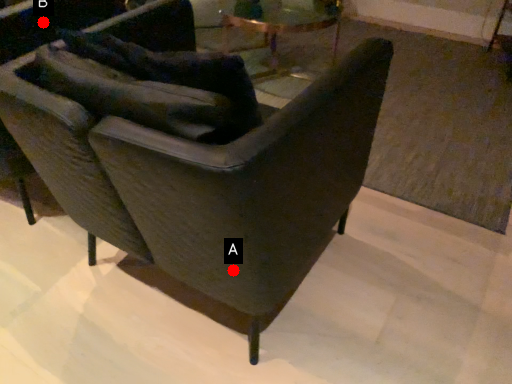
Question: Two points are circled on the image, labeled by A and B beside each circle. Which point is further to the camera?

Choices:
 (A) A is further
 (B) B is further

Answer: (B)